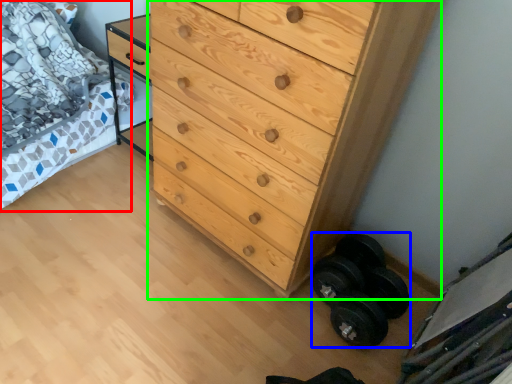
Question: Which object is the closest to the bed (highlighted by a red box)? Choose among these: dumbbell (highlighted by a blue box) or chest of drawers (highlighted by a green box).

Choices:
 (A) dumbbell
 (B) chest of drawers

Answer: (B)